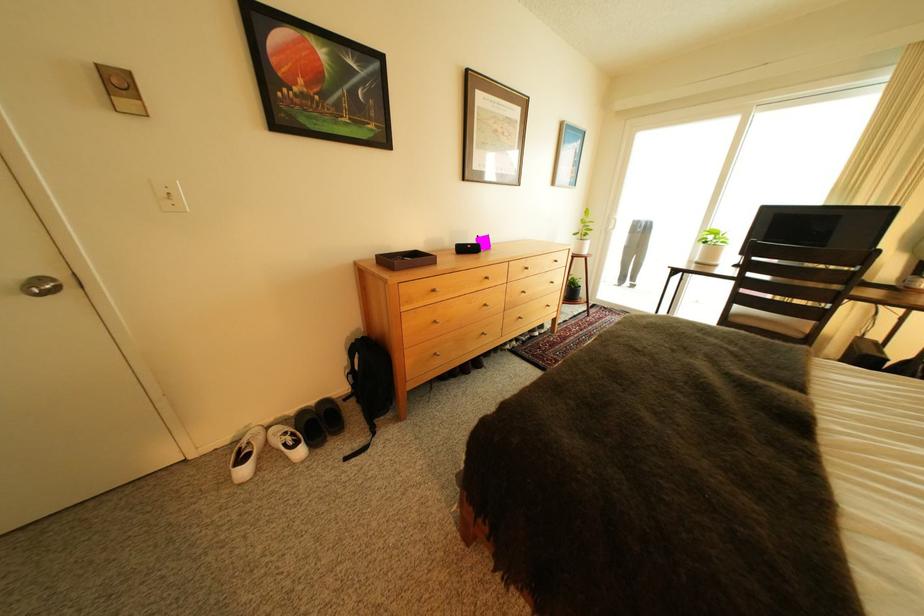
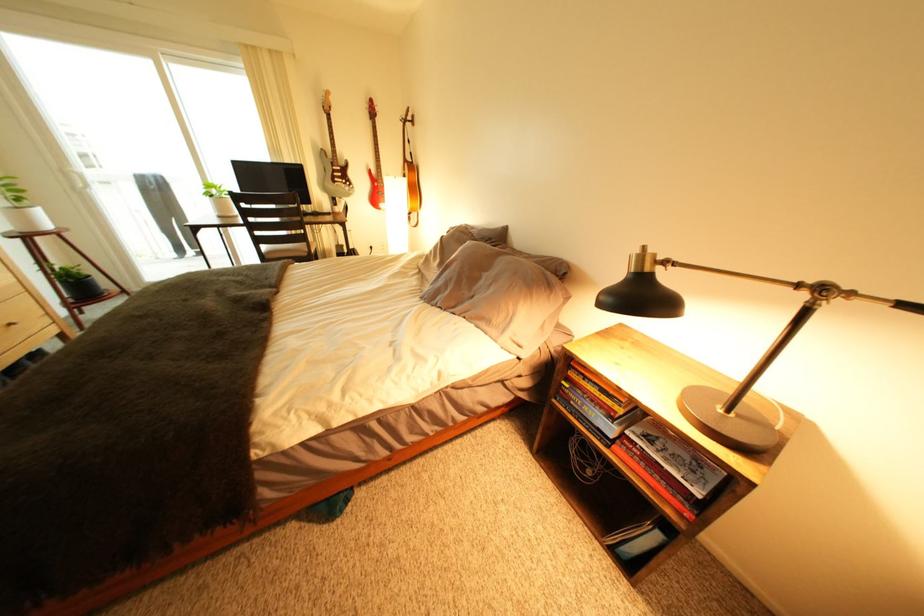
Where in the second image is the point corresponding to point 749,310 from the first image?

(276, 249)